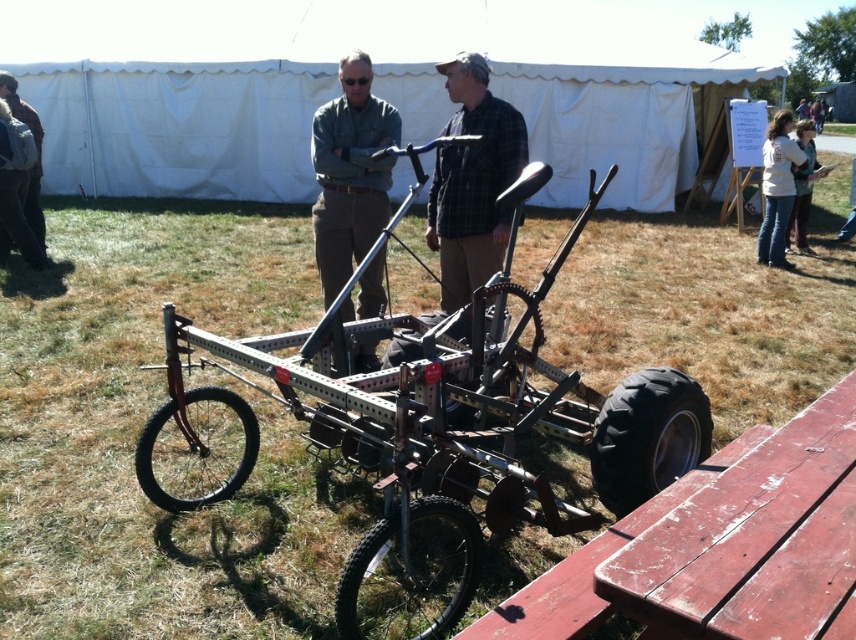
Does plaid fabric shirt at center come behind white cotton shirt at right?

No.

In order to click on plaid fabric shirt at center in this screenshot , I will do `click(473, 180)`.

Is metallic frame tricycle at center wider than white cotton shirt at upper right?

Indeed, metallic frame tricycle at center has a greater width compared to white cotton shirt at upper right.

Who is more distant from viewer, [382,433] or [777,168]?

The point [777,168] is more distant.

You are a GUI agent. You are given a task and a screenshot of the screen. Output one action in this format:
    pyautogui.click(x=<x>, y=<y>)
    Task: Click on the metallic frame tricycle at center
    
    Given the screenshot: What is the action you would take?
    pyautogui.click(x=428, y=428)

Between white fabric tent at upper center and white cotton shirt at right, which one has more height?

Standing taller between the two is white fabric tent at upper center.

Find the location of a particular element. white fabric tent at upper center is located at coordinates (337, 92).